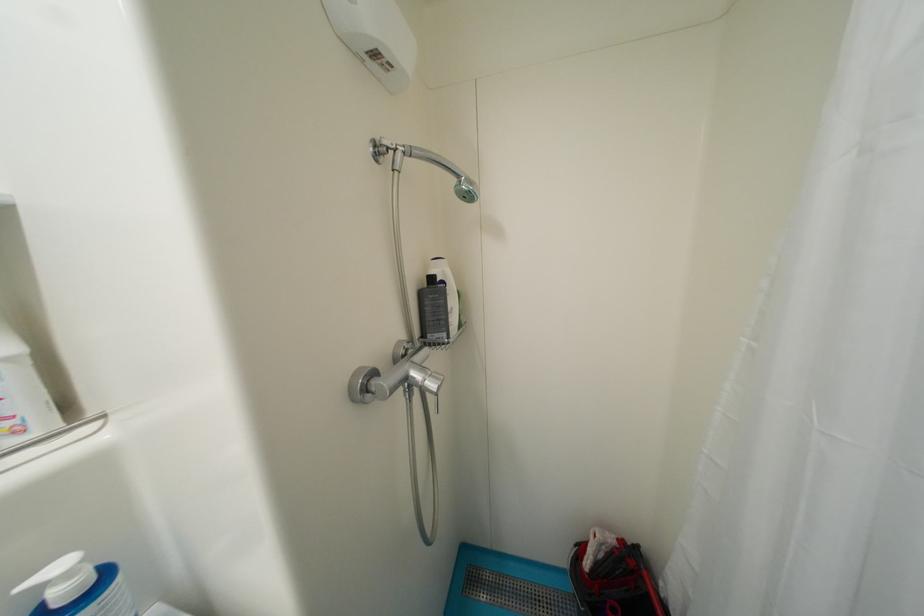
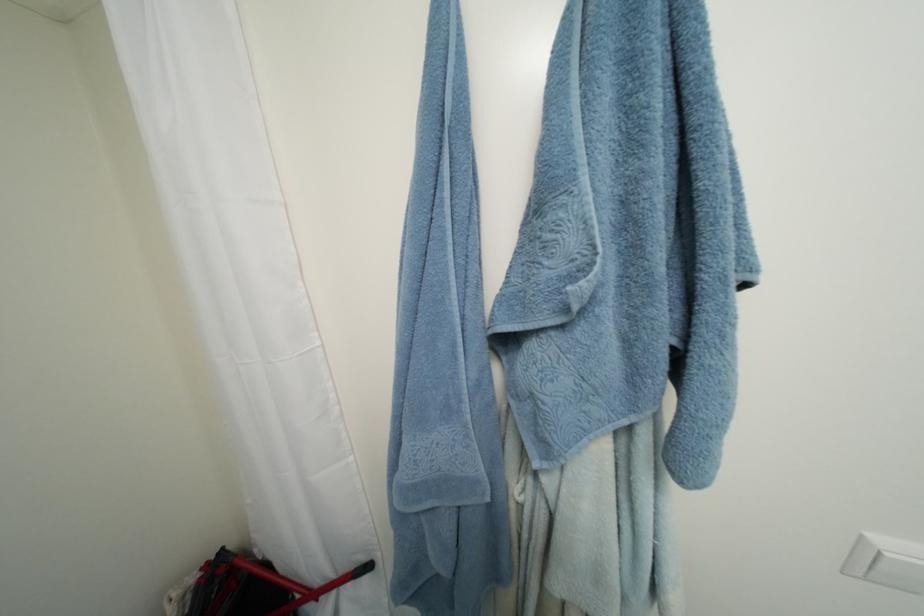
Locate, in the second image, the point that corresponds to [643,548] in the first image.

(229, 552)